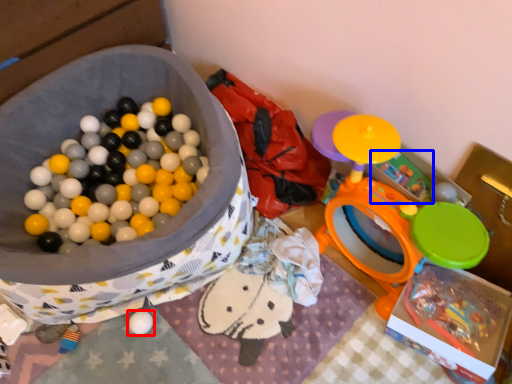
Question: Which object is further to the camera taking this photo, toy (highlighted by a red box) or toy (highlighted by a blue box)?

Choices:
 (A) toy
 (B) toy

Answer: (A)